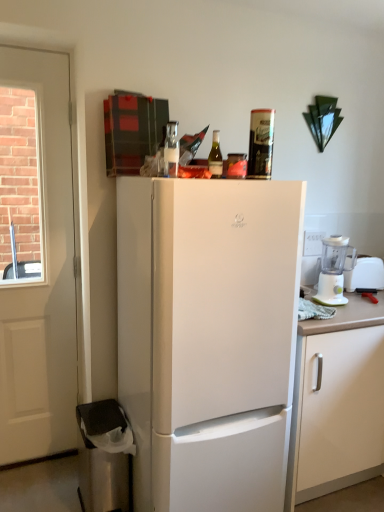
The image size is (384, 512). What do you see at coordinates (171, 150) in the screenshot? I see `clear glass bottle at upper center, the first bottle in the left-to-right sequence` at bounding box center [171, 150].

The width and height of the screenshot is (384, 512). Describe the element at coordinates (36, 257) in the screenshot. I see `white wooden door at left` at that location.

In order to face white matte refrigerator at center, should I rotate leftwards or rightwards?

Turn right by 1.192 degrees to look at white matte refrigerator at center.

Describe the element at coordinates (334, 270) in the screenshot. I see `white plastic blender at right` at that location.

The width and height of the screenshot is (384, 512). In order to click on green glass bottle at top, marked as the second bottle in a left-to-right arrangement in this screenshot , I will do `click(215, 157)`.

Considering their positions, is white wooden door at left located in front of or behind white plastic blender at right?

In the image, white wooden door at left appears in front of white plastic blender at right.

Visually, is white wooden door at left positioned to the left or to the right of white plastic blender at right?

In the image, white wooden door at left appears on the left side of white plastic blender at right.

Considering the points (23, 68) and (375, 284), which point is behind, point (23, 68) or point (375, 284)?

The point (375, 284) is behind.

Which object is wider, white wooden door at left or white plastic blender at right?

With larger width is white plastic blender at right.

What's the angular difference between clear glass bottle at upper center, the first bottle in the left-to-right sequence, and white plastic blender at right's facing directions?

The facing directions of clear glass bottle at upper center, the first bottle in the left-to-right sequence, and white plastic blender at right are 0.00501 degrees apart.

Is clear glass bottle at upper center, the first bottle in the left-to-right sequence, completely or partially outside of white plastic blender at right?

clear glass bottle at upper center, the first bottle in the left-to-right sequence, lies outside white plastic blender at right's area.

Consider the image. Would you say clear glass bottle at upper center, the first bottle in the left-to-right sequence, is to the left or to the right of white plastic blender at right in the picture?

From the image, it's evident that clear glass bottle at upper center, the first bottle in the left-to-right sequence, is to the left of white plastic blender at right.

From the image's perspective, is clear glass bottle at upper center, the first bottle in the left-to-right sequence, on white plastic blender at right?

Indeed, from the image's perspective, clear glass bottle at upper center, the first bottle in the left-to-right sequence, is shown above white plastic blender at right.

Can you confirm if white plastic blender at right is smaller than white matte cabinet at right?

Yes, white plastic blender at right is smaller than white matte cabinet at right.

Consider the image. Which is in front, white plastic blender at right or white matte cabinet at right?

white matte cabinet at right is closer to the camera.

Considering the points (328, 303) and (327, 366), which point is behind, point (328, 303) or point (327, 366)?

The point (328, 303) is farther from the camera.

Is white plastic blender at right shorter than white matte cabinet at right?

Correct, white plastic blender at right is not as tall as white matte cabinet at right.

Is clear glass bottle at upper center, the first bottle in the left-to-right sequence, a part of green glass bottle at top, marked as the second bottle in a left-to-right arrangement?

No, clear glass bottle at upper center, the first bottle in the left-to-right sequence, is located outside of green glass bottle at top, marked as the second bottle in a left-to-right arrangement.

Can you confirm if green glass bottle at top, marked as the second bottle in a left-to-right arrangement, is positioned to the right of clear glass bottle at upper center, which is the second bottle in right-to-left order?

Yes.

Based on the photo, from the image's perspective, is green glass bottle at top, marked as the second bottle in a left-to-right arrangement, located beneath clear glass bottle at upper center, the first bottle in the left-to-right sequence?

Indeed, from the image's perspective, green glass bottle at top, marked as the second bottle in a left-to-right arrangement, is shown beneath clear glass bottle at upper center, the first bottle in the left-to-right sequence.

Is green glass bottle at top, marked as the second bottle in a left-to-right arrangement, oriented towards clear glass bottle at upper center, the first bottle in the left-to-right sequence?

No.

From the picture: Is white matte cabinet at right next to white matte refrigerator at center and touching it?

No, white matte cabinet at right is not in contact with white matte refrigerator at center.

Considering the positions of points (367, 423) and (261, 250), is point (367, 423) farther from camera compared to point (261, 250)?

Yes, it is.

Based on the photo, can you confirm if white matte cabinet at right is shorter than white matte refrigerator at center?

Indeed, white matte cabinet at right has a lesser height compared to white matte refrigerator at center.

Considering the sizes of objects white matte cabinet at right and white matte refrigerator at center in the image provided, who is smaller, white matte cabinet at right or white matte refrigerator at center?

white matte cabinet at right is smaller.

Is white matte refrigerator at center aimed at white plastic blender at right?

No, white matte refrigerator at center is not turned towards white plastic blender at right.

Is white matte refrigerator at center next to white plastic blender at right?

No, white matte refrigerator at center is not touching white plastic blender at right.

Choose the correct answer: Is white matte refrigerator at center inside white plastic blender at right or outside it?

white matte refrigerator at center is not inside white plastic blender at right, it's outside.

Looking at the image, does white matte cabinet at right seem bigger or smaller compared to white plastic blender at right?

Clearly, white matte cabinet at right is larger in size than white plastic blender at right.

From a real-world perspective, is white matte cabinet at right above or below white plastic blender at right?

From a real-world perspective, white matte cabinet at right is physically below white plastic blender at right.

From the picture: Could you tell me if white matte cabinet at right is facing white plastic blender at right?

No, white matte cabinet at right does not turn towards white plastic blender at right.

Is white matte cabinet at right touching white plastic blender at right?

No, white matte cabinet at right is not making contact with white plastic blender at right.

I want to click on door that is in front of the white plastic blender at right, so click(36, 257).

This screenshot has width=384, height=512. Identify the location of blender on the right of clear glass bottle at upper center, which is the second bottle in right-to-left order. (334, 270).

Looking at the image, which one is located closer to white matte cabinet at right, green glass bottle at top, marked as the second bottle in a left-to-right arrangement, or white wooden door at left?

The object closer to white matte cabinet at right is green glass bottle at top, marked as the second bottle in a left-to-right arrangement.

Consider the image. Based on their spatial positions, is white plastic blender at right or white plastic blender at right closer to white matte refrigerator at center?

white plastic blender at right is closer to white matte refrigerator at center.

When comparing their distances from clear glass bottle at upper center, which is the second bottle in right-to-left order, does white wooden door at left or white matte refrigerator at center seem further?

The object further to clear glass bottle at upper center, which is the second bottle in right-to-left order, is white wooden door at left.

Estimate the real-world distances between objects in this image. Which object is closer to clear glass bottle at upper center, which is the second bottle in right-to-left order, white wooden door at left or white plastic blender at right?

Based on the image, white wooden door at left appears to be nearer to clear glass bottle at upper center, which is the second bottle in right-to-left order.

From the image, which object appears to be nearer to white wooden door at left, white matte refrigerator at center or clear glass bottle at upper center, which is the second bottle in right-to-left order?

white matte refrigerator at center.

Which object lies further to the anchor point white plastic blender at right, white matte cabinet at right or white plastic blender at right?

white matte cabinet at right is further to white plastic blender at right.

Looking at the image, which one is located closer to green glass bottle at top, which appears as the first bottle when viewed from the right, white plastic blender at right or clear glass bottle at upper center, which is the second bottle in right-to-left order?

Based on the image, clear glass bottle at upper center, which is the second bottle in right-to-left order, appears to be nearer to green glass bottle at top, which appears as the first bottle when viewed from the right.

From the image, which object appears to be farther from white matte refrigerator at center, white plastic blender at right or white wooden door at left?

The object further to white matte refrigerator at center is white plastic blender at right.

Identify the location of cabinetry between white matte refrigerator at center and white plastic blender at right. This screenshot has width=384, height=512. pyautogui.click(x=337, y=402).

Identify the location of bottle that lies between clear glass bottle at upper center, the first bottle in the left-to-right sequence, and white matte refrigerator at center from top to bottom. This screenshot has height=512, width=384. (215, 157).

Find the location of a particular element. bottle situated between white wooden door at left and green glass bottle at top, which appears as the first bottle when viewed from the right, from left to right is located at coordinates (171, 150).

Find the location of a particular element. blender between white matte refrigerator at center and white plastic blender at right from front to back is located at coordinates (334, 270).